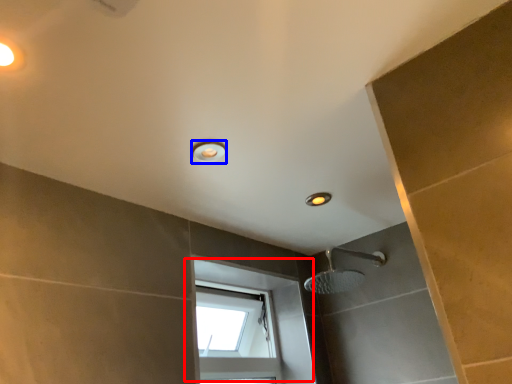
Question: Which of the following is the closest to the observer, window (highlighted by a red box) or light fixture (highlighted by a blue box)?

Choices:
 (A) window
 (B) light fixture

Answer: (B)